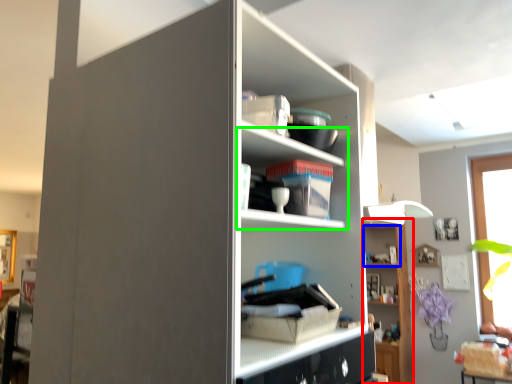
Question: Considering the real-world distances, which object is farthest from shelf (highlighted by a red box)? cabinet (highlighted by a blue box) or shelf (highlighted by a green box)?

Choices:
 (A) cabinet
 (B) shelf

Answer: (B)